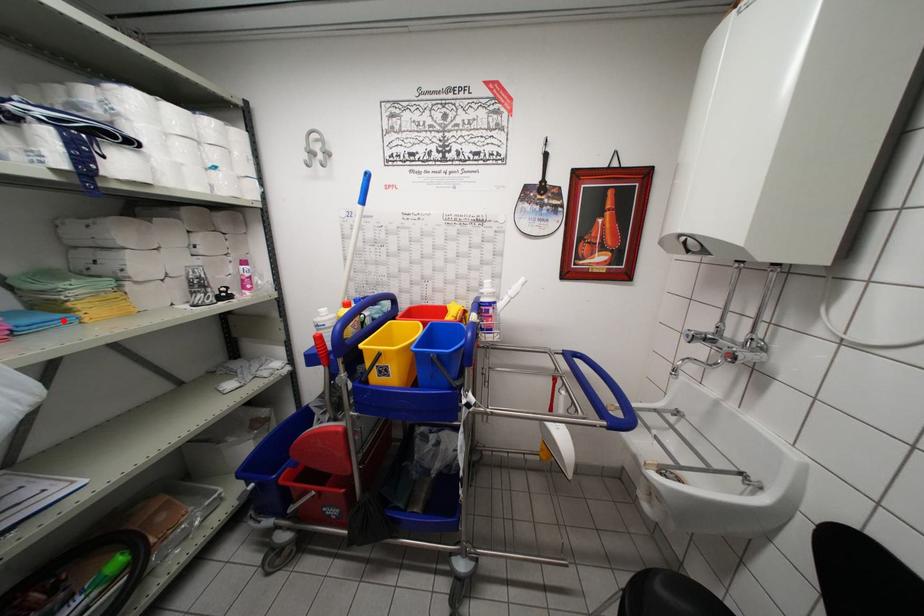
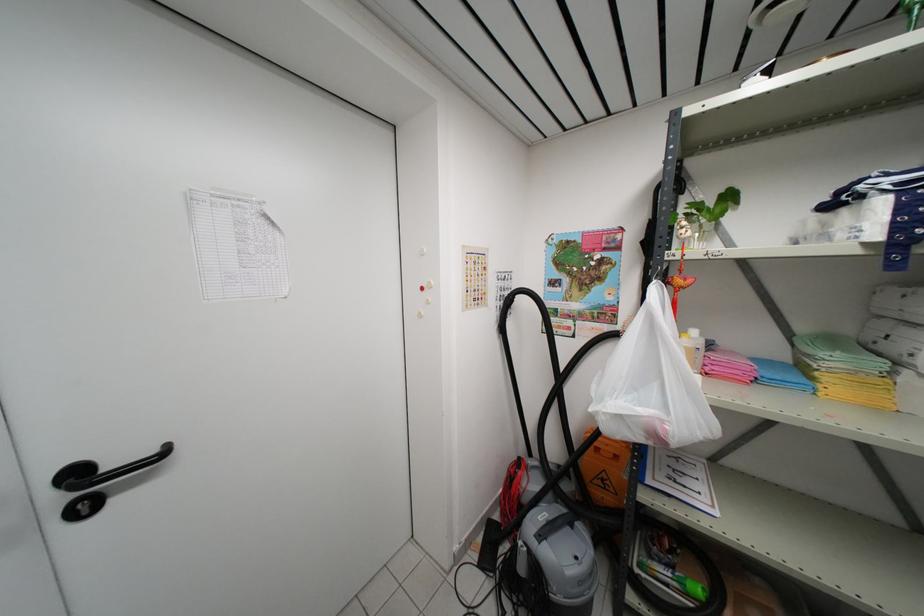
The point at the highlighted location is marked in the first image. Where is the corresponding point in the second image?

(806, 385)